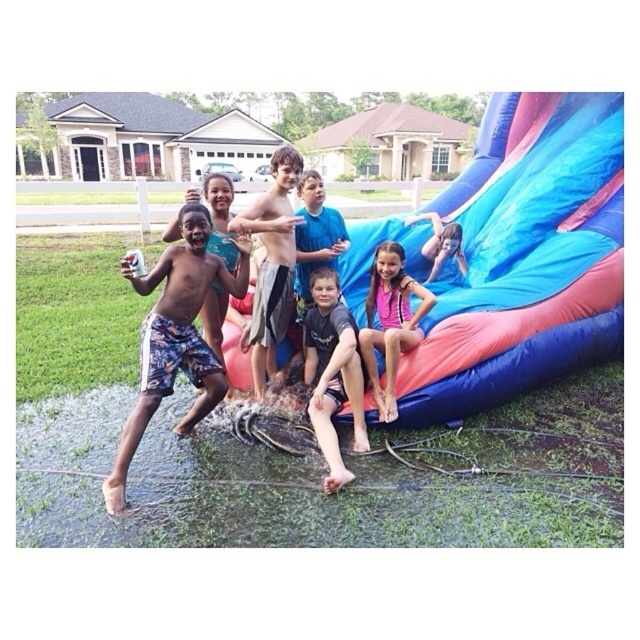
Does printed cotton shorts at left appear over pink fabric at center?

Incorrect, printed cotton shorts at left is not positioned above pink fabric at center.

Can you confirm if printed cotton shorts at left is taller than pink fabric at center?

Yes, printed cotton shorts at left is taller than pink fabric at center.

This screenshot has width=640, height=640. I want to click on printed cotton shorts at left, so click(176, 337).

Locate an element on the screen. printed cotton shorts at left is located at coordinates (176, 337).

Who is positioned more to the right, pink fabric at center or blue fabric slide at upper right?

Positioned to the right is blue fabric slide at upper right.

Is pink fabric at center shorter than blue fabric slide at upper right?

No, pink fabric at center is not shorter than blue fabric slide at upper right.

This screenshot has height=640, width=640. What are the coordinates of `pink fabric at center` in the screenshot? It's located at (390, 321).

Which is more to the right, dark gray t-shirt at center or blue fabric slide at upper right?

From the viewer's perspective, blue fabric slide at upper right appears more on the right side.

Which is above, dark gray t-shirt at center or blue fabric slide at upper right?

blue fabric slide at upper right

You are a GUI agent. You are given a task and a screenshot of the screen. Output one action in this format:
    pyautogui.click(x=<x>, y=<y>)
    Task: Click on the dark gray t-shirt at center
    This screenshot has height=640, width=640.
    Given the screenshot: What is the action you would take?
    click(x=332, y=372)

Find the location of a particular element. The width and height of the screenshot is (640, 640). dark gray t-shirt at center is located at coordinates (332, 372).